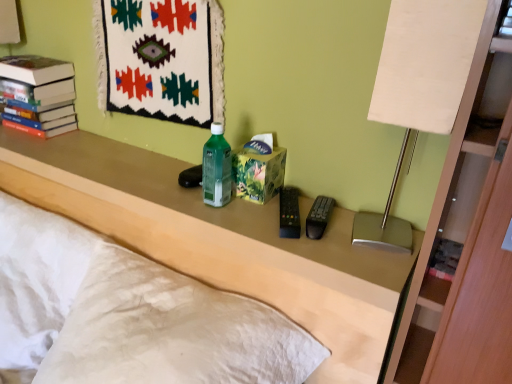
Identify the location of empty space that is to the right of hardcover books at upper left. The image size is (512, 384). (75, 140).